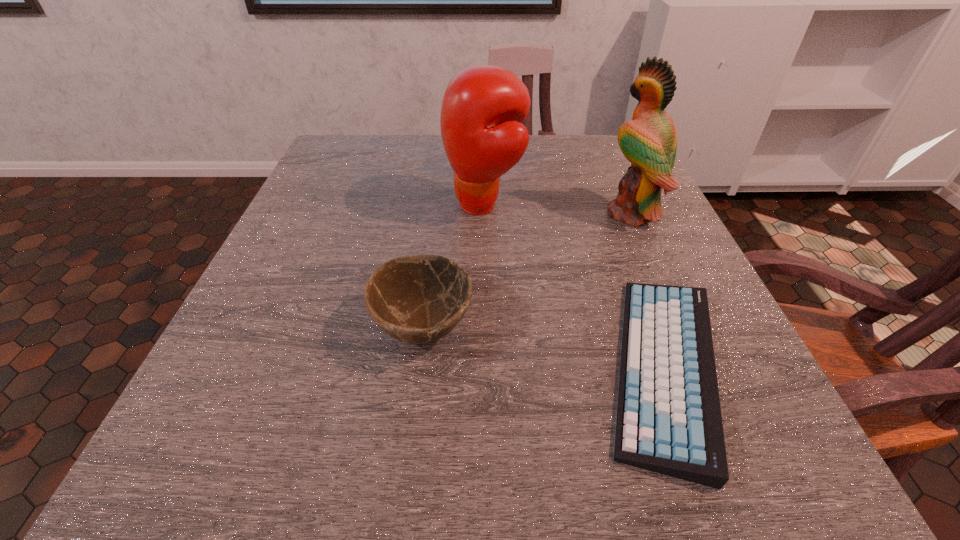
Identify the location of parrot. This screenshot has height=540, width=960. (649, 141).

Identify the location of boxing glove. (483, 107).

I want to click on the second shortest object, so click(418, 299).

Locate an element on the screen. the shortest object is located at coordinates (669, 421).

Identify the location of free space located 0.100m on the front-facing side of the parrot. (557, 213).

Locate an element on the screen. The width and height of the screenshot is (960, 540). vacant space located 0.150m on the front-facing side of the parrot is located at coordinates pyautogui.click(x=533, y=213).

This screenshot has width=960, height=540. In order to click on vacant space located 0.120m on the front-facing side of the parrot in this screenshot , I will do `click(547, 213)`.

Locate an element on the screen. This screenshot has width=960, height=540. vacant space located 0.210m on the striking surface of the boxing glove is located at coordinates (348, 205).

Image resolution: width=960 pixels, height=540 pixels. I want to click on free point located 0.280m on the striking surface of the boxing glove, so click(317, 205).

Where is `vacant space located 0.100m on the striking surface of the boxing glove`? Image resolution: width=960 pixels, height=540 pixels. vacant space located 0.100m on the striking surface of the boxing glove is located at coordinates (399, 205).